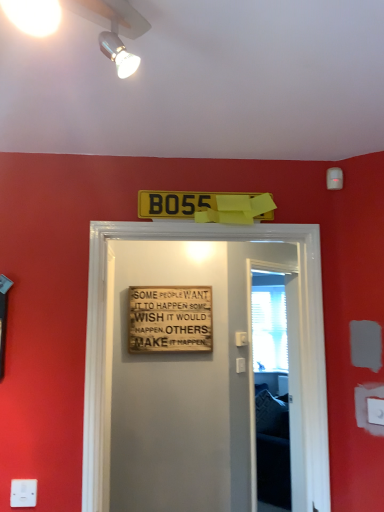
Question: Can we say yellow plastic license plate at center, positioned as the 2th warning sign in back-to-front order, lies outside wooden signboard at center?

Choices:
 (A) yes
 (B) no

Answer: (A)

Question: Is yellow plastic license plate at center, the 1th warning sign from the top, behind wooden signboard at center?

Choices:
 (A) no
 (B) yes

Answer: (B)

Question: Considering the relative sizes of yellow plastic license plate at center, which appears as the 1th warning sign when viewed from the front, and wooden signboard at center in the image provided, is yellow plastic license plate at center, which appears as the 1th warning sign when viewed from the front, smaller than wooden signboard at center?

Choices:
 (A) no
 (B) yes

Answer: (B)

Question: Does yellow plastic license plate at center, the 2th warning sign in the bottom-to-top sequence, turn towards wooden signboard at center?

Choices:
 (A) no
 (B) yes

Answer: (A)

Question: Does yellow plastic license plate at center, the 2th warning sign in the bottom-to-top sequence, have a lesser height compared to wooden signboard at center?

Choices:
 (A) no
 (B) yes

Answer: (B)

Question: Considering the relative positions of white plastic electric outlet at lower left, placed as the 2th electric outlet when sorted from right to left, and transparent plastic screen door at center in the image provided, is white plastic electric outlet at lower left, placed as the 2th electric outlet when sorted from right to left, to the left or to the right of transparent plastic screen door at center?

Choices:
 (A) left
 (B) right

Answer: (A)

Question: Is white plastic electric outlet at lower left, which ranks as the first electric outlet in bottom-to-top order, in front of or behind transparent plastic screen door at center in the image?

Choices:
 (A) front
 (B) behind

Answer: (A)

Question: Choose the correct answer: Is white plastic electric outlet at lower left, which appears as the 2th electric outlet when viewed from the top, inside transparent plastic screen door at center or outside it?

Choices:
 (A) outside
 (B) inside

Answer: (A)

Question: Does point (29, 480) appear closer or farther from the camera than point (296, 509)?

Choices:
 (A) farther
 (B) closer

Answer: (B)

Question: In the image, is yellow plastic license plate at center, positioned as the 2th warning sign in back-to-front order, positioned in front of or behind white mesh screen at right?

Choices:
 (A) behind
 (B) front

Answer: (B)

Question: Considering the positions of point pos(170,209) and point pos(269,352), is point pos(170,209) closer or farther from the camera than point pos(269,352)?

Choices:
 (A) farther
 (B) closer

Answer: (B)

Question: Is yellow plastic license plate at center, the 1th warning sign from the top, wider or thinner than white mesh screen at right?

Choices:
 (A) wide
 (B) thin

Answer: (A)

Question: Is yellow plastic license plate at center, the 2th warning sign in the bottom-to-top sequence, situated inside white mesh screen at right or outside?

Choices:
 (A) inside
 (B) outside

Answer: (B)

Question: Would you say white plastic electric outlet at lower right, which is the 2th electric outlet in left-to-right order, is to the left or to the right of transparent plastic screen door at center in the picture?

Choices:
 (A) left
 (B) right

Answer: (B)

Question: Is white plastic electric outlet at lower right, acting as the first electric outlet starting from the top, wider or thinner than transparent plastic screen door at center?

Choices:
 (A) thin
 (B) wide

Answer: (A)